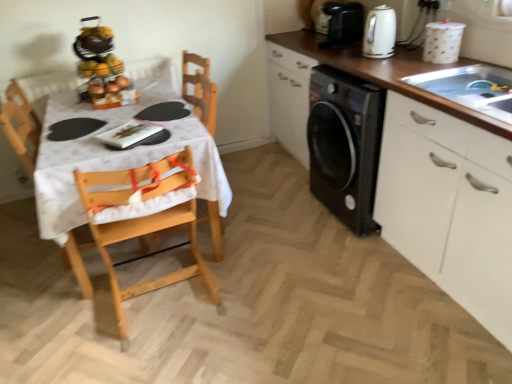
Image resolution: width=512 pixels, height=384 pixels. In order to click on vacant location below wooden highchair at left (from a real-world perspective) in this screenshot , I will do `click(170, 300)`.